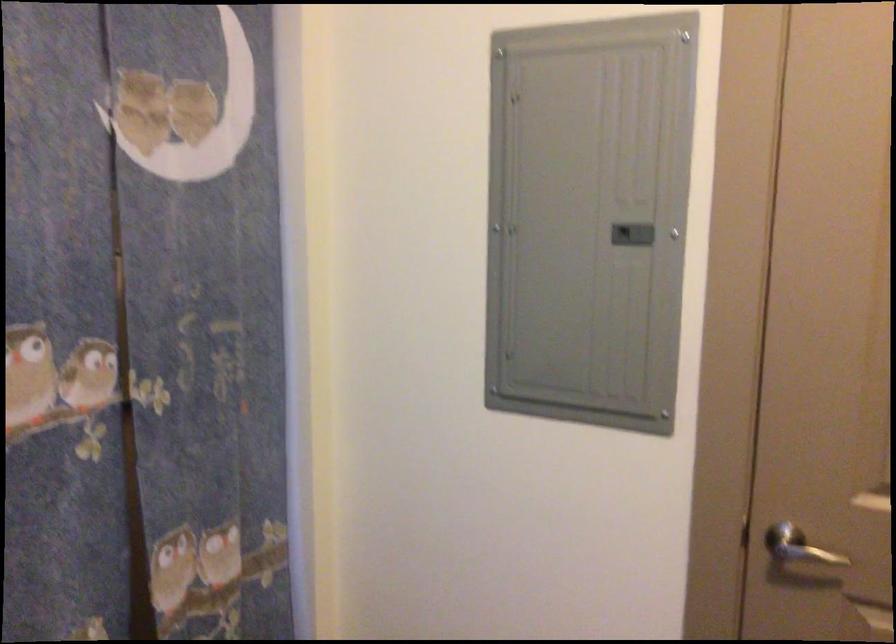
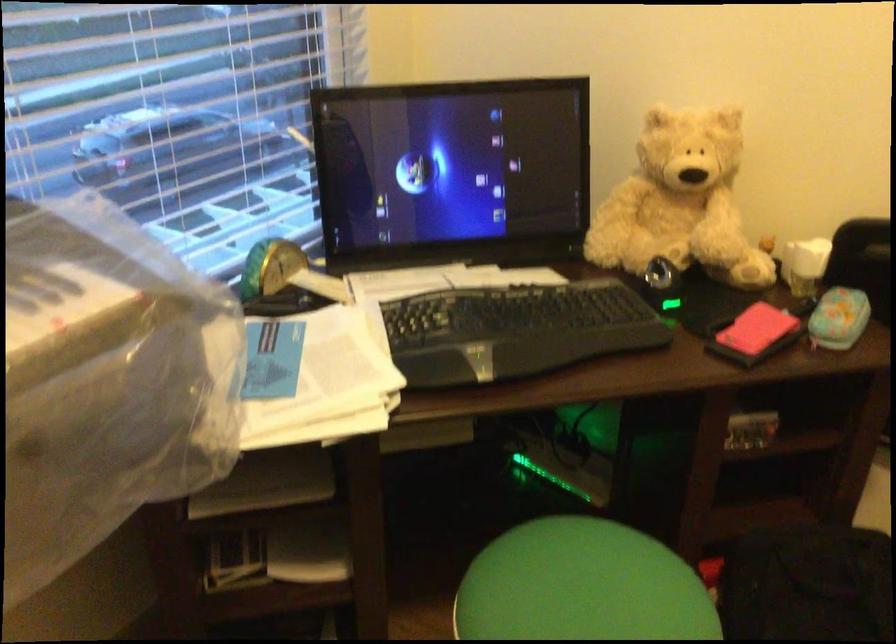
How did the camera likely rotate?

The camera's rotation is toward left-down.